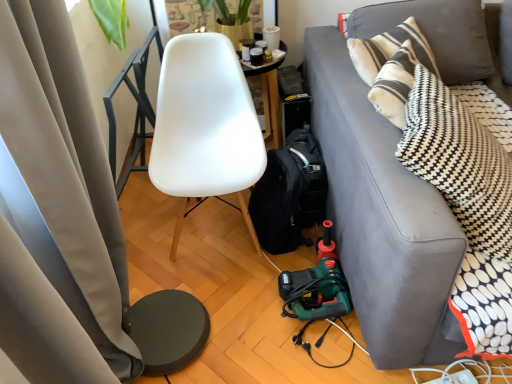
Find the location of a particular element. free spot to the right of matte gray curtain at left is located at coordinates coord(267,327).